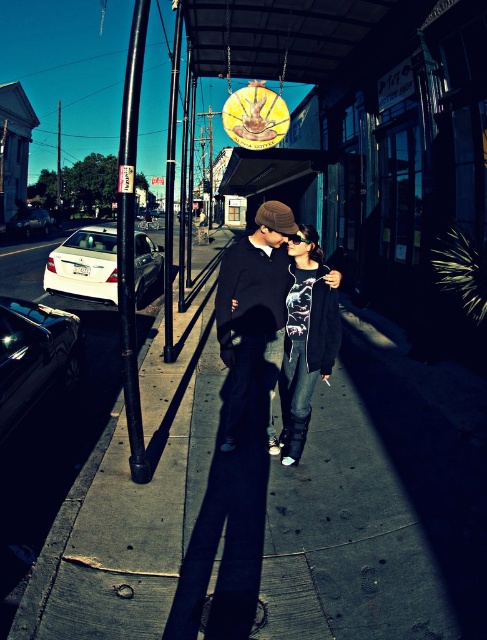
Consider the image. Does dark concrete sidewalk at center appear under black metal pole at left?

Correct, dark concrete sidewalk at center is located below black metal pole at left.

Describe the element at coordinates (278, 509) in the screenshot. I see `dark concrete sidewalk at center` at that location.

The width and height of the screenshot is (487, 640). In order to click on dark concrete sidewalk at center in this screenshot , I will do `click(278, 509)`.

Is point (305, 348) more distant than point (124, 144)?

Yes, point (305, 348) is farther from viewer.

Is point (288, 372) positioned after point (128, 307)?

Yes, point (288, 372) is behind point (128, 307).

Locate an element on the screen. The width and height of the screenshot is (487, 640). denim jacket at center is located at coordinates (305, 339).

Who is more forward, (235, 259) or (167, 291)?

Point (235, 259) is in front.

Identify the location of matte black hoodie at center. The height and width of the screenshot is (640, 487). (254, 314).

This screenshot has width=487, height=640. Find the location of `matte black hoodie at center`. matte black hoodie at center is located at coordinates (254, 314).